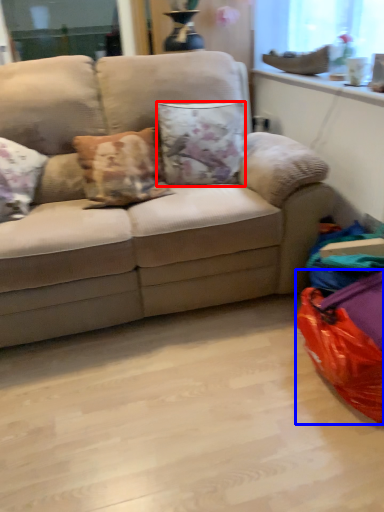
Question: Which object appears closest to the camera in this image, pillow (highlighted by a red box) or bean bag chair (highlighted by a blue box)?

Choices:
 (A) pillow
 (B) bean bag chair

Answer: (B)